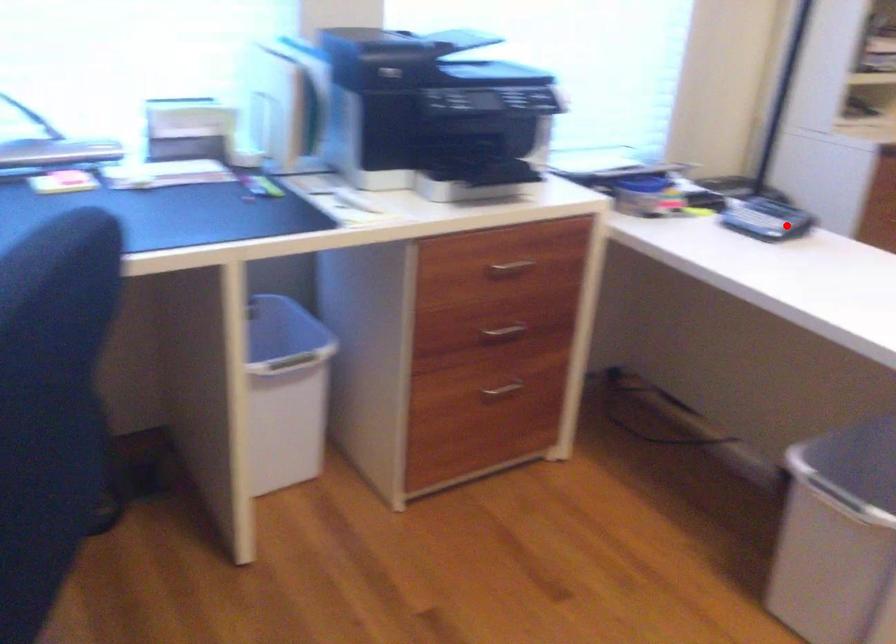
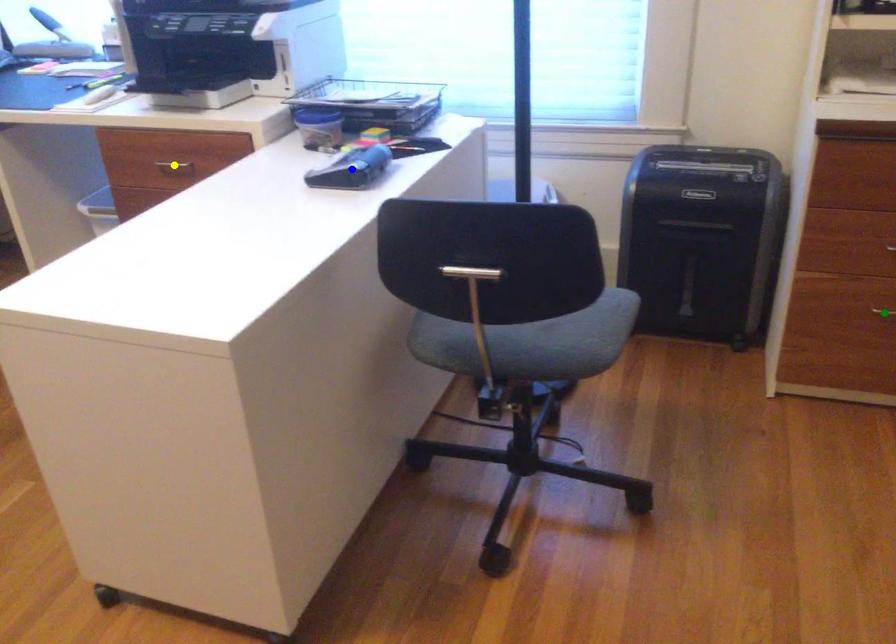
Question: I am providing you with two images of the same scene from different viewpoints. A red point is marked on the first image. You are given multiple points on the second image. Which point in image 2 is actually the same real-world point as the red point in image 1?

Choices:
 (A) blue point
 (B) yellow point
 (C) green point

Answer: (A)